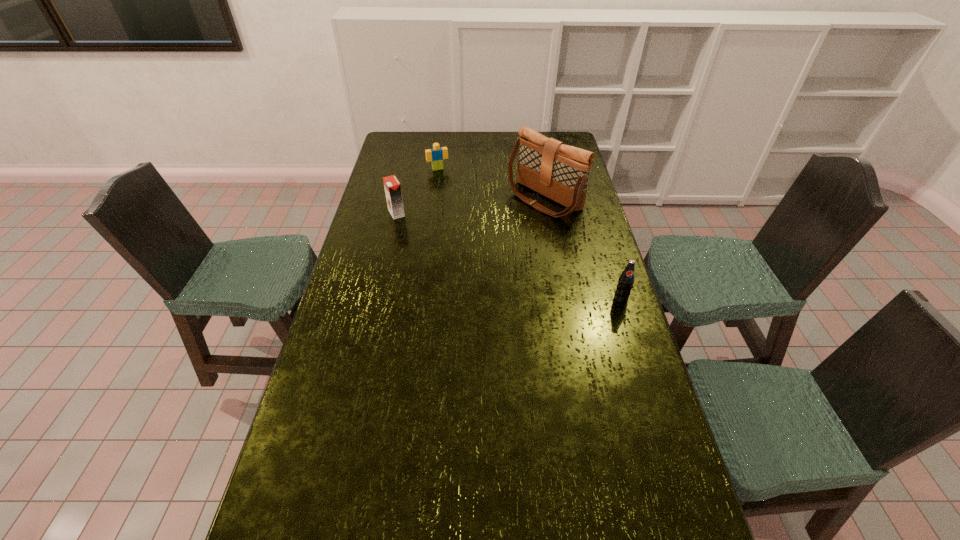
Image resolution: width=960 pixels, height=540 pixels. Find the location of `free area in between the pop and the orange juice`. free area in between the pop and the orange juice is located at coordinates (509, 256).

You are a GUI agent. You are given a task and a screenshot of the screen. Output one action in this format:
    pyautogui.click(x=<x>, y=<y>)
    Task: Click on the unoccupied position between the orange juice and the second object from right to left
    The image size is (960, 540).
    Given the screenshot: What is the action you would take?
    coord(470,206)

I want to click on free space that is in between the shoulder bag and the rightmost object, so click(583, 249).

At what (x,y) coordinates should I click in order to perform the action: click on the closest object to the shoulder bag. Please return your answer as a coordinate pair (x, y). Looking at the image, I should click on (436, 155).

This screenshot has width=960, height=540. I want to click on object that can be found as the closest to the shoulder bag, so click(x=436, y=155).